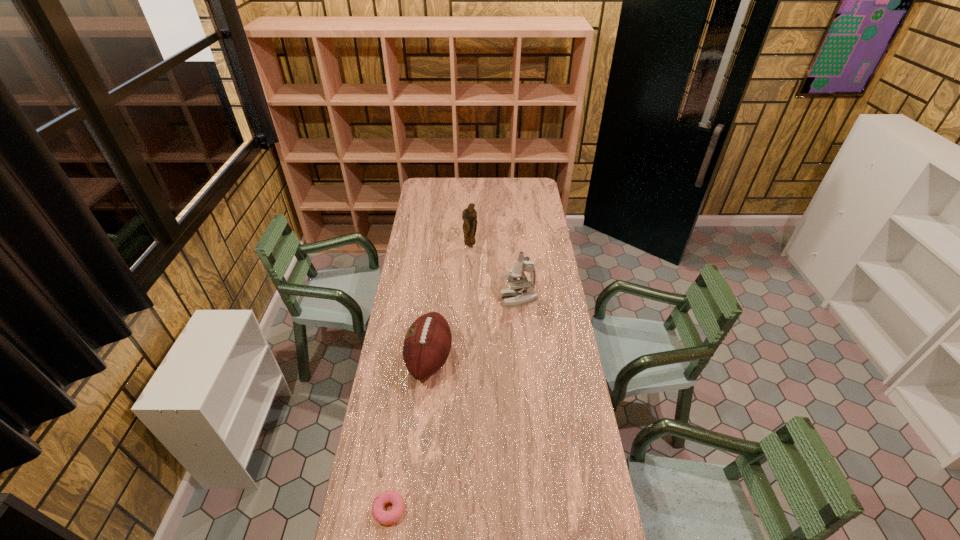
Identify the location of the second object from right to left. The height and width of the screenshot is (540, 960). 469,215.

This screenshot has height=540, width=960. I want to click on the farthest object, so click(x=469, y=215).

Where is `the second farthest object`? The width and height of the screenshot is (960, 540). the second farthest object is located at coordinates (522, 291).

Find the location of a particular element. The height and width of the screenshot is (540, 960). the rightmost object is located at coordinates (522, 291).

Find the location of a particular element. The height and width of the screenshot is (540, 960). football (American) is located at coordinates (427, 343).

At what (x,y) coordinates should I click in order to perform the action: click on the second shortest object. Please return your answer as a coordinate pair (x, y). The width and height of the screenshot is (960, 540). Looking at the image, I should click on (427, 343).

Identify the location of the shortest object. (383, 517).

Locate an element on the screen. The image size is (960, 540). the nearest object is located at coordinates tap(383, 517).

Where is `vacant space located 0.160m on the front-facing side of the farthest object`? The image size is (960, 540). vacant space located 0.160m on the front-facing side of the farthest object is located at coordinates (469, 268).

Find the location of a particular element. Image resolution: width=960 pixels, height=540 pixels. blank area located on the back of the rightmost object is located at coordinates (515, 258).